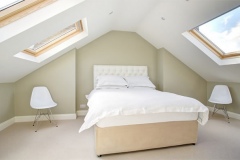
Find the location of `mattress`. mattress is located at coordinates (169, 119).